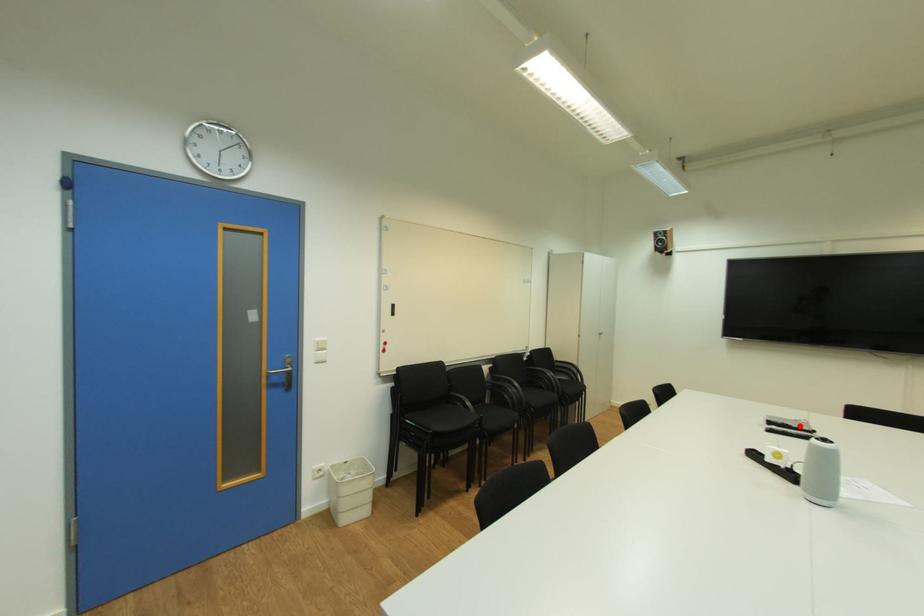
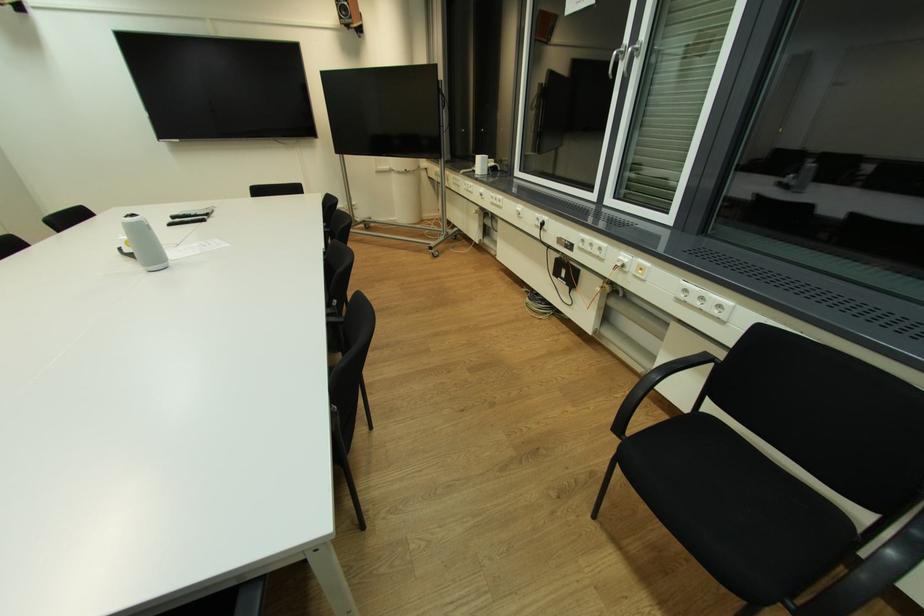
The point at the highlighted location is marked in the first image. Where is the corresponding point in the second image?

(198, 214)